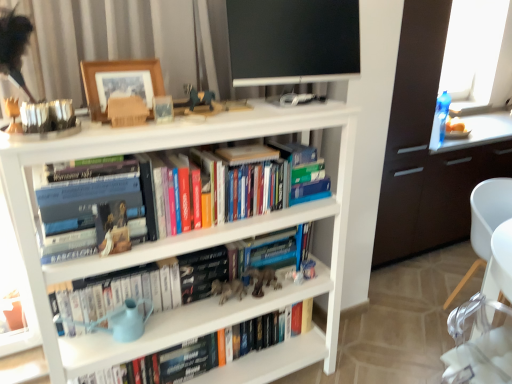
The image size is (512, 384). What do you see at coordinates (88, 207) in the screenshot? I see `hardcover books at center` at bounding box center [88, 207].

Identify the location of dark wood cabinet at right. This screenshot has height=384, width=512. (426, 150).

Locate an element on the screen. wooden picture frame at upper center is located at coordinates (120, 83).

What do you see at coordinates (478, 51) in the screenshot? This screenshot has height=384, width=512. I see `transparent glass window at upper right` at bounding box center [478, 51].

Locate an element on the screen. Image resolution: width=512 pixels, height=384 pixels. transparent glass window at upper right is located at coordinates coord(478,51).

What do you see at coordinates (293, 41) in the screenshot? This screenshot has width=512, height=384. I see `black glossy flat-screen tv at upper center` at bounding box center [293, 41].

Locate an element on the screen. The width and height of the screenshot is (512, 384). metallic silver figurine at center is located at coordinates click(x=263, y=280).

Measure the distance between metallic silver figurine at center and camera.

The depth of metallic silver figurine at center is 5.96 feet.

This screenshot has width=512, height=384. In order to click on hardcover book at center in this screenshot , I will do `click(201, 272)`.

Find the location of a particular element. Image resolution: width=512 pixels, height=384 pixels. hardcover books at center is located at coordinates (88, 207).

How many degrees apart are the facing directions of hardcover books at center and dark wood cabinet at right?

7.34e-05 degrees separate the facing orientations of hardcover books at center and dark wood cabinet at right.

Is hardcover books at center facing away from dark wood cabinet at right?

That's not correct — hardcover books at center is not looking away from dark wood cabinet at right.

From the image's perspective, is hardcover books at center located above or below dark wood cabinet at right?

hardcover books at center is below dark wood cabinet at right.

Which object is positioned more to the right, metallic silver figurine at center or black glossy flat-screen tv at upper center?

black glossy flat-screen tv at upper center.

Is metallic silver figurine at center wider or thinner than black glossy flat-screen tv at upper center?

Considering their sizes, metallic silver figurine at center looks slimmer than black glossy flat-screen tv at upper center.

Is metallic silver figurine at center facing towards black glossy flat-screen tv at upper center?

No, metallic silver figurine at center is not facing towards black glossy flat-screen tv at upper center.

Is metallic silver figurine at center taller than black glossy flat-screen tv at upper center?

In fact, metallic silver figurine at center may be shorter than black glossy flat-screen tv at upper center.

Which is in front, black glossy flat-screen tv at upper center or hardcover book at center?

Positioned in front is black glossy flat-screen tv at upper center.

Does black glossy flat-screen tv at upper center have a lesser width compared to hardcover book at center?

Yes, black glossy flat-screen tv at upper center is thinner than hardcover book at center.

Looking at this image, which object is positioned more to the right, black glossy flat-screen tv at upper center or hardcover book at center?

black glossy flat-screen tv at upper center is more to the right.

How many degrees apart are the facing directions of black glossy flat-screen tv at upper center and hardcover book at center?

7.92 degrees separate the facing orientations of black glossy flat-screen tv at upper center and hardcover book at center.

From the image's perspective, between metallic silver figurine at center and transparent glass window at upper right, who is located below?

metallic silver figurine at center, from the image's perspective.

Which object is thinner, metallic silver figurine at center or transparent glass window at upper right?

metallic silver figurine at center.

This screenshot has height=384, width=512. In the image, there is a transparent glass window at upper right. What are the coordinates of `toy below it (from a real-world perspective)` in the screenshot? It's located at (263, 280).

Does transparent glass window at upper right come behind black glossy flat-screen tv at upper center?

Yes.

Are transparent glass window at upper right and black glossy flat-screen tv at upper center beside each other?

No.

From a real-world perspective, which object stands above the other?

black glossy flat-screen tv at upper center is physically above.

How different are the orientations of transparent glass window at upper right and black glossy flat-screen tv at upper center in degrees?

transparent glass window at upper right and black glossy flat-screen tv at upper center are facing 7.92 degrees away from each other.

Is hardcover books at center located within hardcover book at center?

No, hardcover books at center is not surrounded by hardcover book at center.

From a real-world perspective, is hardcover book at center on top of hardcover books at center?

No, from a real-world perspective, hardcover book at center is not above hardcover books at center.

Is the depth of hardcover book at center greater than that of hardcover books at center?

Yes, hardcover book at center is behind hardcover books at center.

Is hardcover book at center aimed at hardcover books at center?

No, hardcover book at center is not aimed at hardcover books at center.

In the image, there is a hardcover book at center. Identify the location of chair below it (from the image's perspective). This screenshot has height=384, width=512. (484, 221).

Can you confirm if hardcover book at center is bigger than white plastic chair at lower right?

No, hardcover book at center is not bigger than white plastic chair at lower right.

Considering the relative positions of hardcover book at center and white plastic chair at lower right in the image provided, is hardcover book at center to the right of white plastic chair at lower right from the viewer's perspective?

No.

Considering the points (185, 260) and (484, 187), which point is behind, point (185, 260) or point (484, 187)?

Point (484, 187)

You are a GUI agent. You are given a task and a screenshot of the screen. Output one action in this format:
    pyautogui.click(x=<x>, y=<y>)
    Task: Click on the book on the left of dark wood cabinet at right
    
    Given the screenshot: What is the action you would take?
    pos(88,207)

The width and height of the screenshot is (512, 384). Find the location of `television located above the metallic silver figurine at center (from a real-world perspective)`. television located above the metallic silver figurine at center (from a real-world perspective) is located at coordinates (293, 41).

When comparing their distances from metallic silver figurine at center, does wooden picture frame at upper center or dark wood cabinet at right seem closer?

The object closer to metallic silver figurine at center is wooden picture frame at upper center.

Based on their spatial positions, is wooden picture frame at upper center or hardcover books at center further from hardcover book at center?

Among the two, wooden picture frame at upper center is located further to hardcover book at center.

When comparing their distances from metallic silver figurine at center, does hardcover books at center or wooden picture frame at upper center seem closer?

hardcover books at center.

Based on their spatial positions, is metallic silver figurine at center or hardcover book at center further from dark wood cabinet at right?

hardcover book at center.

From the image, which object appears to be nearer to transparent glass window at upper right, metallic silver figurine at center or dark wood cabinet at right?

dark wood cabinet at right is positioned closer to the anchor transparent glass window at upper right.

Which object lies nearer to the anchor point dark wood cabinet at right, transparent glass window at upper right or wooden picture frame at upper center?

transparent glass window at upper right is closer to dark wood cabinet at right.

Looking at the image, which one is located further to metallic silver figurine at center, hardcover book at center or transparent glass window at upper right?

transparent glass window at upper right is further to metallic silver figurine at center.

Based on the photo, from the image, which object appears to be nearer to hardcover books at center, dark wood cabinet at right or black glossy flat-screen tv at upper center?

The object closer to hardcover books at center is black glossy flat-screen tv at upper center.

Where is `picture frame between hardcover books at center and dark wood cabinet at right`? This screenshot has height=384, width=512. picture frame between hardcover books at center and dark wood cabinet at right is located at coordinates (120, 83).

I want to click on paperback book between wooden picture frame at upper center and dark wood cabinet at right in the horizontal direction, so click(x=201, y=272).

Where is `book between black glossy flat-screen tv at upper center and metallic silver figurine at center from top to bottom`? book between black glossy flat-screen tv at upper center and metallic silver figurine at center from top to bottom is located at coordinates (88, 207).

Find the location of a particular element. book between wooden picture frame at upper center and metallic silver figurine at center in the vertical direction is located at coordinates coord(88,207).